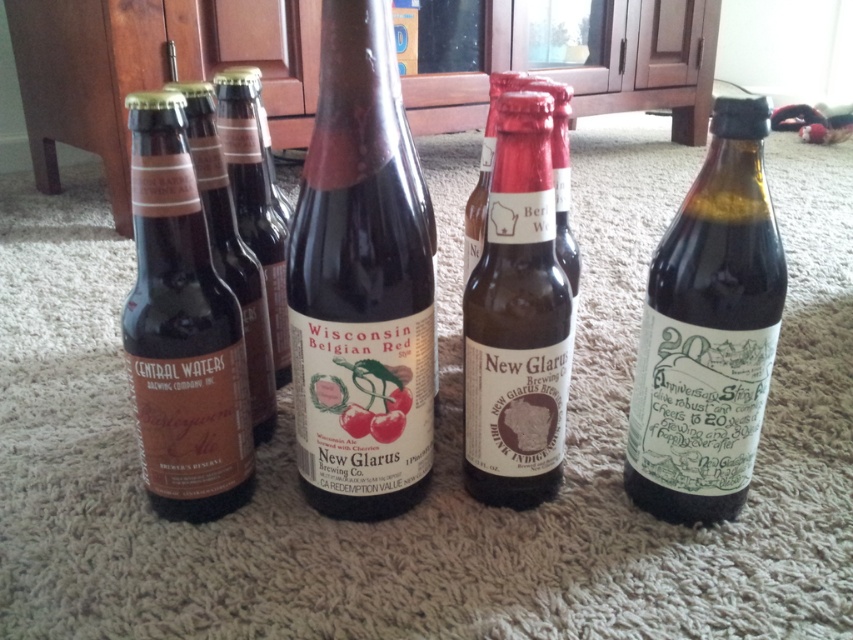
Question: Does green glass bottle at right appear over matte brown bottle at center?

Choices:
 (A) no
 (B) yes

Answer: (A)

Question: Which point is closer to the camera?

Choices:
 (A) (202, 112)
 (B) (248, 113)
 (C) (490, 166)

Answer: (A)

Question: Which point is farther from the camera taking this photo?

Choices:
 (A) (701, 420)
 (B) (239, 211)
 (C) (491, 80)

Answer: (C)

Question: Can you confirm if green glass bottle at right is positioned below brown matte glass bottle at center?

Choices:
 (A) yes
 (B) no

Answer: (A)

Question: Can you confirm if brown matte glass bottle at center is thinner than matte brown glass bottle at left?

Choices:
 (A) yes
 (B) no

Answer: (B)

Question: Which is nearer to the brown glass bottle at center?

Choices:
 (A) brown matte glass bottle at center
 (B) dark brown glass bottle at center
 (C) matte brown bottle at center
 (D) matte brown glass beer bottle at left

Answer: (D)